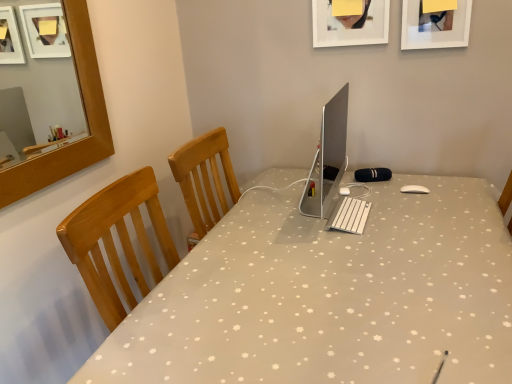
Find the location of `free space in front of white plastic keyboard at center`. free space in front of white plastic keyboard at center is located at coordinates (388, 245).